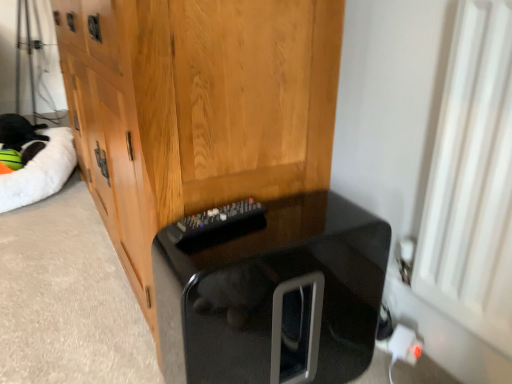
The width and height of the screenshot is (512, 384). What do you see at coordinates (405, 345) in the screenshot?
I see `white plastic plug at lower right` at bounding box center [405, 345].

The image size is (512, 384). Describe the element at coordinates (40, 172) in the screenshot. I see `white fluffy cat bed at left` at that location.

Identify the location of wooden cabinet at center. This screenshot has height=384, width=512. (200, 113).

This screenshot has width=512, height=384. In order to click on white plastic plug at lower right in this screenshot , I will do `click(405, 345)`.

Measure the distance from white fluffy cat bed at left to black glossy cat litter box at lower center.

A distance of 1.08 meters exists between white fluffy cat bed at left and black glossy cat litter box at lower center.

Can you confirm if white fluffy cat bed at left is wider than black glossy cat litter box at lower center?

Yes, white fluffy cat bed at left is wider than black glossy cat litter box at lower center.

From a real-world perspective, which object stands above the other?

In real-world perspective, black glossy cat litter box at lower center is above.

From the image's perspective, relative to black glossy cat litter box at lower center, is white fluffy cat bed at left above or below?

Based on their image positions, white fluffy cat bed at left is located above black glossy cat litter box at lower center.

Visually, is white fluffy cat bed at left positioned to the left or to the right of white plastic plug at lower right?

white fluffy cat bed at left is positioned on white plastic plug at lower right's left side.

Considering the relative sizes of white fluffy cat bed at left and white plastic plug at lower right in the image provided, is white fluffy cat bed at left wider than white plastic plug at lower right?

Indeed, white fluffy cat bed at left has a greater width compared to white plastic plug at lower right.

Measure the distance between white fluffy cat bed at left and white plastic plug at lower right.

white fluffy cat bed at left and white plastic plug at lower right are 1.44 meters apart from each other.

Is white fluffy cat bed at left oriented away from white plastic plug at lower right?

No, white fluffy cat bed at left's orientation is not away from white plastic plug at lower right.

Considering the points (414, 360) and (331, 147), which point is behind, point (414, 360) or point (331, 147)?

The point (331, 147) is more distant.

Is white plastic plug at lower right behind wooden cabinet at center?

Yes, it is.

Which of these two, white plastic plug at lower right or wooden cabinet at center, is smaller?

white plastic plug at lower right is smaller.

How different are the orientations of white plastic plug at lower right and wooden cabinet at center in degrees?

20.6 degrees separate the facing orientations of white plastic plug at lower right and wooden cabinet at center.

How far apart are wooden cabinet at center and white fluffy cat bed at left?

wooden cabinet at center and white fluffy cat bed at left are 37.48 inches apart from each other.

Is the depth of wooden cabinet at center less than that of white fluffy cat bed at left?

Yes.

Does point (298, 195) lie behind point (46, 144)?

No, it is in front of (46, 144).

How far apart are black glossy cat litter box at lower center and white plastic plug at lower right?

12.67 inches.

Is black glossy cat litter box at lower center bigger or smaller than white plastic plug at lower right?

In the image, black glossy cat litter box at lower center appears to be larger than white plastic plug at lower right.

Consider the image. Considering the relative sizes of black glossy cat litter box at lower center and white plastic plug at lower right in the image provided, is black glossy cat litter box at lower center wider than white plastic plug at lower right?

Correct, the width of black glossy cat litter box at lower center exceeds that of white plastic plug at lower right.

From the image's perspective, which object appears higher, black glossy cat litter box at lower center or white plastic plug at lower right?

black glossy cat litter box at lower center appears higher in the image.

Is wooden cabinet at center in front of black glossy cat litter box at lower center?

Yes, it is in front of black glossy cat litter box at lower center.

Can you tell me how much wooden cabinet at center and black glossy cat litter box at lower center differ in facing direction?

1.24 degrees separate the facing orientations of wooden cabinet at center and black glossy cat litter box at lower center.

At what (x,y) coordinates should I click in order to perform the action: click on cabinetry in front of the black glossy cat litter box at lower center. Please return your answer as a coordinate pair (x, y). This screenshot has height=384, width=512. Looking at the image, I should click on (200, 113).

Considering the sizes of objects wooden cabinet at center and black glossy cat litter box at lower center in the image provided, who is taller, wooden cabinet at center or black glossy cat litter box at lower center?

wooden cabinet at center.

Does black glossy cat litter box at lower center appear on the left side of wooden cabinet at center?

No, black glossy cat litter box at lower center is not to the left of wooden cabinet at center.

From the image's perspective, is black glossy cat litter box at lower center above or below wooden cabinet at center?

black glossy cat litter box at lower center is below wooden cabinet at center.

Which object is closer to the camera taking this photo, black glossy cat litter box at lower center or wooden cabinet at center?

wooden cabinet at center is in front.

Would you say black glossy cat litter box at lower center is inside or outside wooden cabinet at center?

black glossy cat litter box at lower center cannot be found inside wooden cabinet at center.

Image resolution: width=512 pixels, height=384 pixels. I want to click on cat bed located behind the black glossy cat litter box at lower center, so click(40, 172).

Locate an element on the screen. This screenshot has height=384, width=512. electric outlet located in front of the white fluffy cat bed at left is located at coordinates (405, 345).

Considering their positions, is black glossy cat litter box at lower center positioned closer to white plastic plug at lower right than white fluffy cat bed at left?

black glossy cat litter box at lower center is positioned closer to the anchor white plastic plug at lower right.

When comparing their distances from black glossy cat litter box at lower center, does white fluffy cat bed at left or wooden cabinet at center seem closer?

The object closer to black glossy cat litter box at lower center is wooden cabinet at center.

Based on their spatial positions, is wooden cabinet at center or black glossy cat litter box at lower center further from white plastic plug at lower right?

wooden cabinet at center is positioned further to the anchor white plastic plug at lower right.

Estimate the real-world distances between objects in this image. Which object is further from white plastic plug at lower right, wooden cabinet at center or white fluffy cat bed at left?

white fluffy cat bed at left is further to white plastic plug at lower right.

Looking at this image, from the image, which object appears to be nearer to black glossy cat litter box at lower center, wooden cabinet at center or white fluffy cat bed at left?

Based on the image, wooden cabinet at center appears to be nearer to black glossy cat litter box at lower center.

Based on their spatial positions, is wooden cabinet at center or black glossy cat litter box at lower center closer to white fluffy cat bed at left?

wooden cabinet at center.

Based on their spatial positions, is white fluffy cat bed at left or black glossy cat litter box at lower center closer to wooden cabinet at center?

black glossy cat litter box at lower center lies closer to wooden cabinet at center than the other object.

Based on their spatial positions, is black glossy cat litter box at lower center or wooden cabinet at center closer to white plastic plug at lower right?

black glossy cat litter box at lower center lies closer to white plastic plug at lower right than the other object.

At what (x,y) coordinates should I click in order to perform the action: click on furniture located between white fluffy cat bed at left and white plastic plug at lower right in the left-right direction. Please return your answer as a coordinate pair (x, y). Looking at the image, I should click on (267, 295).

This screenshot has width=512, height=384. In order to click on cabinetry located between white fluffy cat bed at left and white plastic plug at lower right in the left-right direction in this screenshot , I will do `click(200, 113)`.

Where is `cabinetry between white fluffy cat bed at left and black glossy cat litter box at lower center in the horizontal direction`? Image resolution: width=512 pixels, height=384 pixels. cabinetry between white fluffy cat bed at left and black glossy cat litter box at lower center in the horizontal direction is located at coordinates (200, 113).

Find the location of `furniture located between wooden cabinet at center and white plastic plug at lower right in the left-right direction`. furniture located between wooden cabinet at center and white plastic plug at lower right in the left-right direction is located at coordinates pos(267,295).